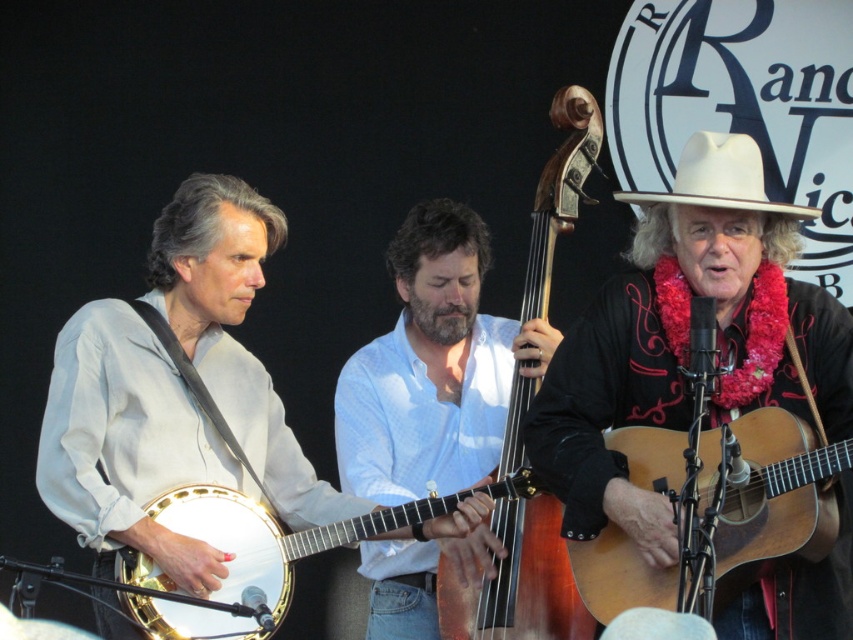
You are a photographer trying to capture the musician playing the banjo. You notice two points in the scene marked as point 1 at coordinates point (849, 634) and point 2 at coordinates point (535, 388). Which point is closer to your camera lens?

Point 1 at coordinates point (849, 634) is closer to the camera lens than point 2 at coordinates point (535, 388).

From the picture: You are a photographer standing near the camera. You want to capture a closeup shot of the wooden acoustic guitar at center. Given that your camera has a minimum focusing distance of 2 meters, can you move closer to the guitar to take the photo?

The wooden acoustic guitar at center and camera are 3.36 meters apart from each other. Since the minimum focusing distance is 2 meters, you can move closer to the guitar to take the photo as long as you stay at least 2 meters away.